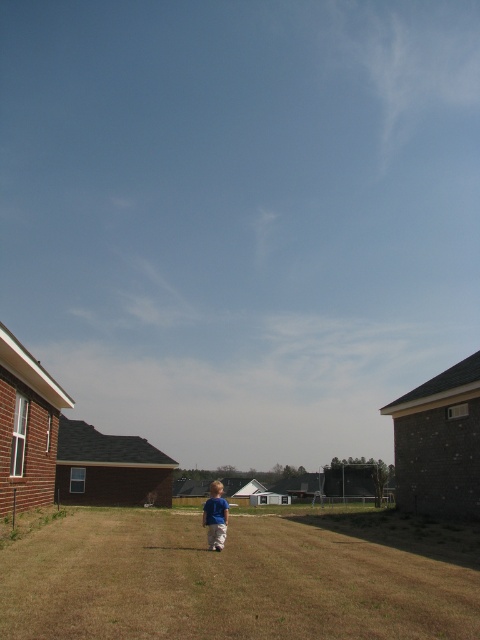
Between brown dry grass at center and blue cotton shirt at center, which one is positioned higher?

Positioned higher is brown dry grass at center.

Which is behind, point (177, 556) or point (228, 506)?

Positioned behind is point (228, 506).

The height and width of the screenshot is (640, 480). Find the location of `brown dry grass at center`. brown dry grass at center is located at coordinates (225, 580).